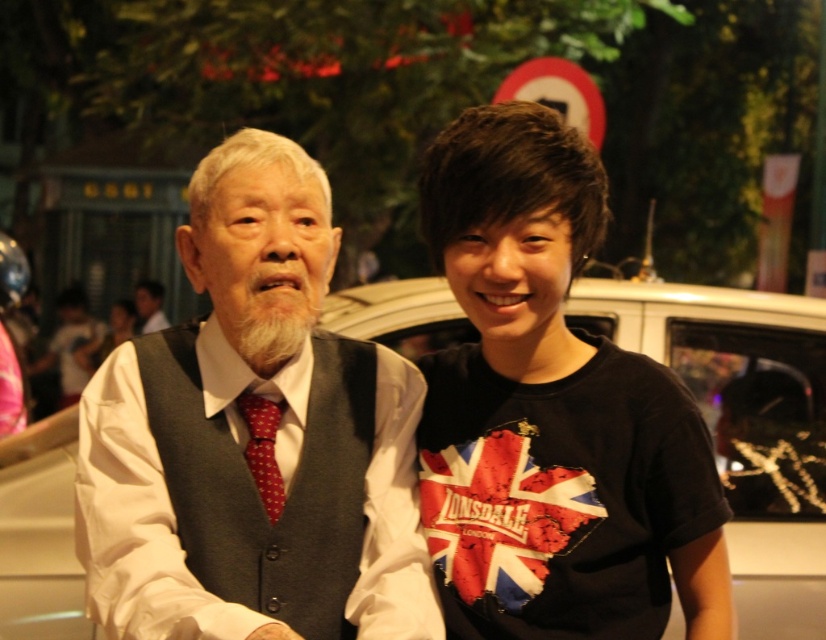
You are a photographer standing in front of the white glossy car at center. You want to take a photo of the car but need to stay at least 4 meters away to avoid being in the shot. Can you do that?

The white glossy car at center is 3.80 meters away from camera, so you cannot stay at least 4 meters away to avoid being in the shot because you are already closer than required.